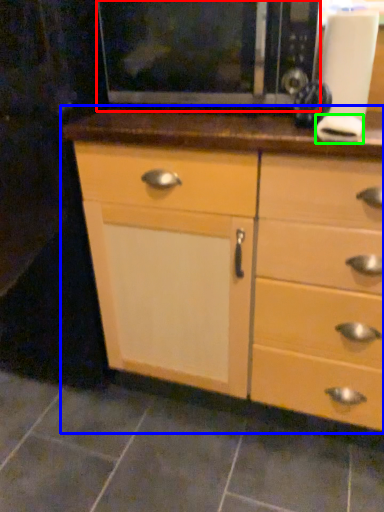
Question: Which object is positioned closest to microwave (highlighted by a red box)? Select from chest of drawers (highlighted by a blue box) and knob (highlighted by a green box).

Choices:
 (A) chest of drawers
 (B) knob

Answer: (B)